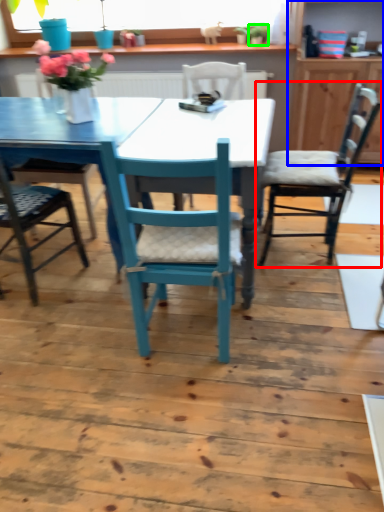
Question: Estimate the real-world distances between objects in this image. Which object is farther from chair (highlighted by a red box), dresser (highlighted by a blue box) or houseplant (highlighted by a green box)?

Choices:
 (A) dresser
 (B) houseplant

Answer: (B)